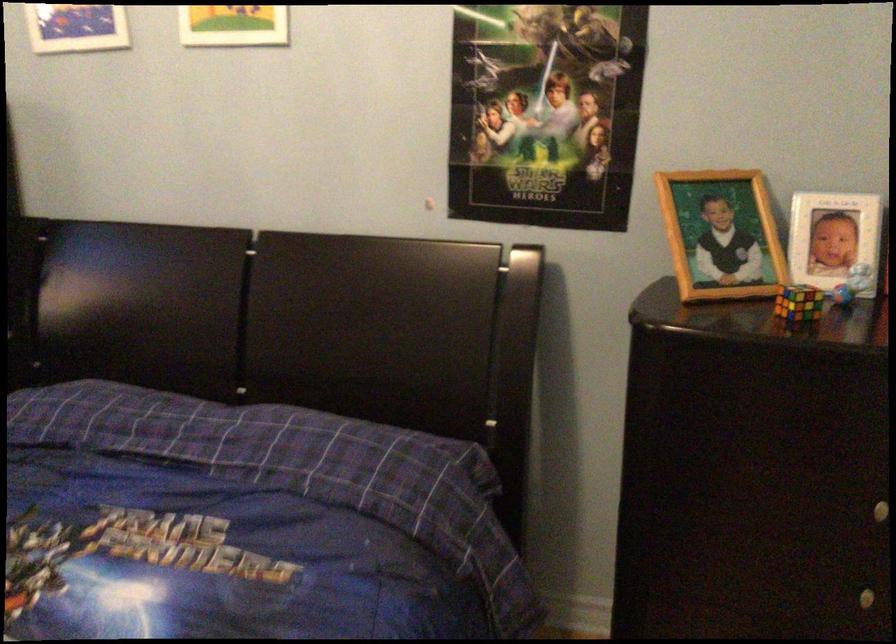
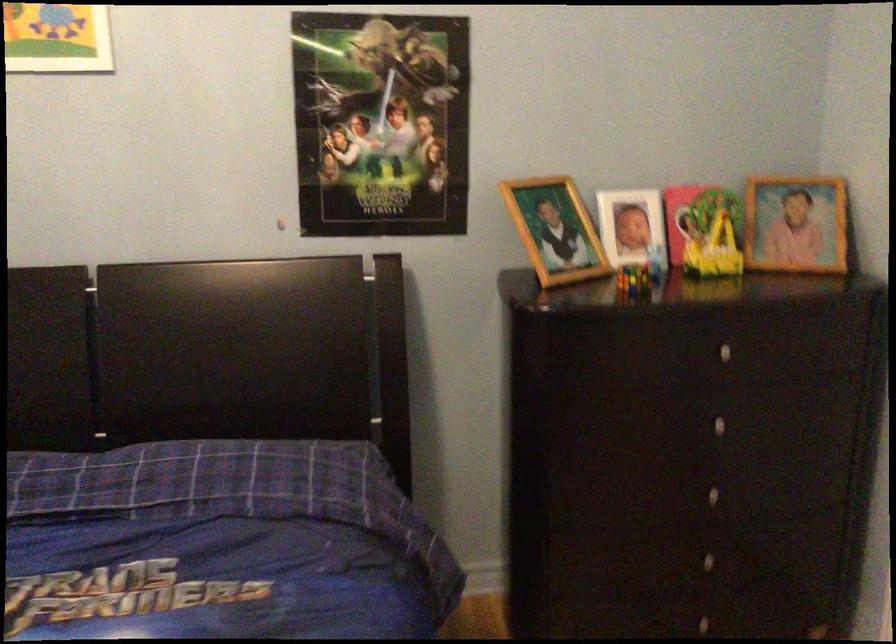
In the second image, find the point that corresponds to point 721,240 in the first image.

(555, 230)